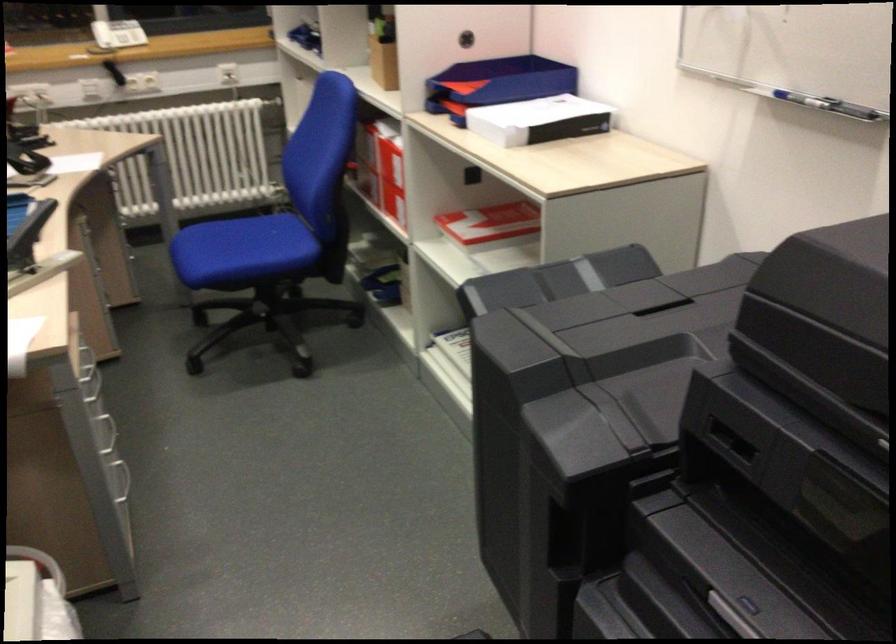
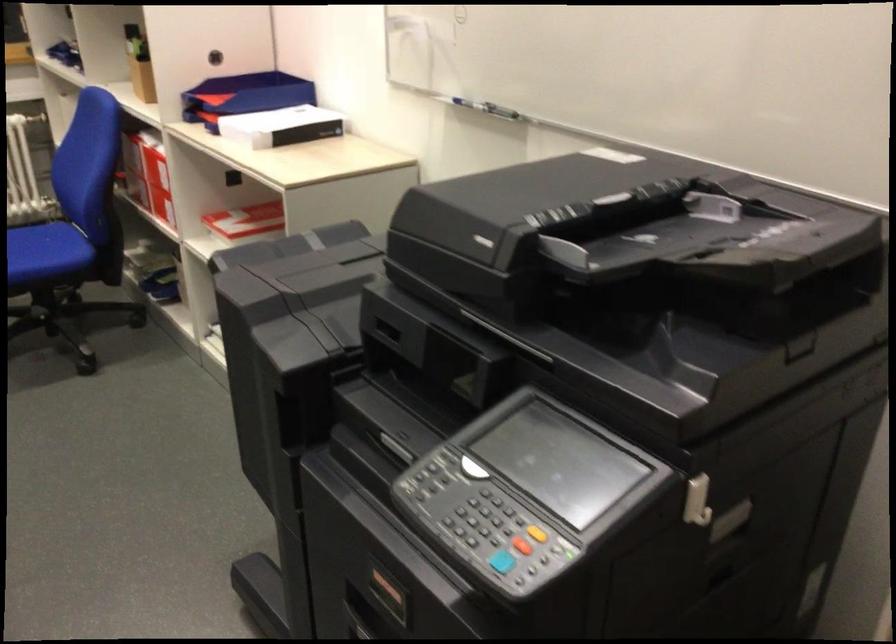
Find the pixel in the second image that matches point 815,100 in the first image.

(478, 105)